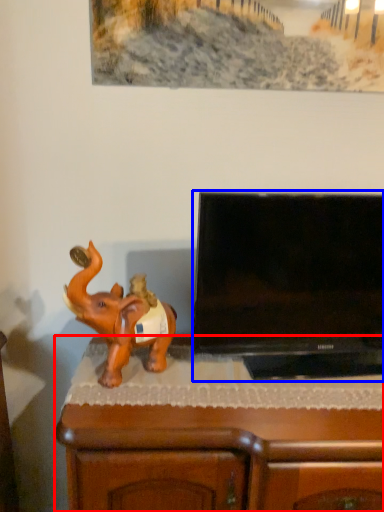
Question: Among these objects, which one is nearest to the camera, furniture (highlighted by a red box) or television (highlighted by a blue box)?

Choices:
 (A) furniture
 (B) television

Answer: (B)